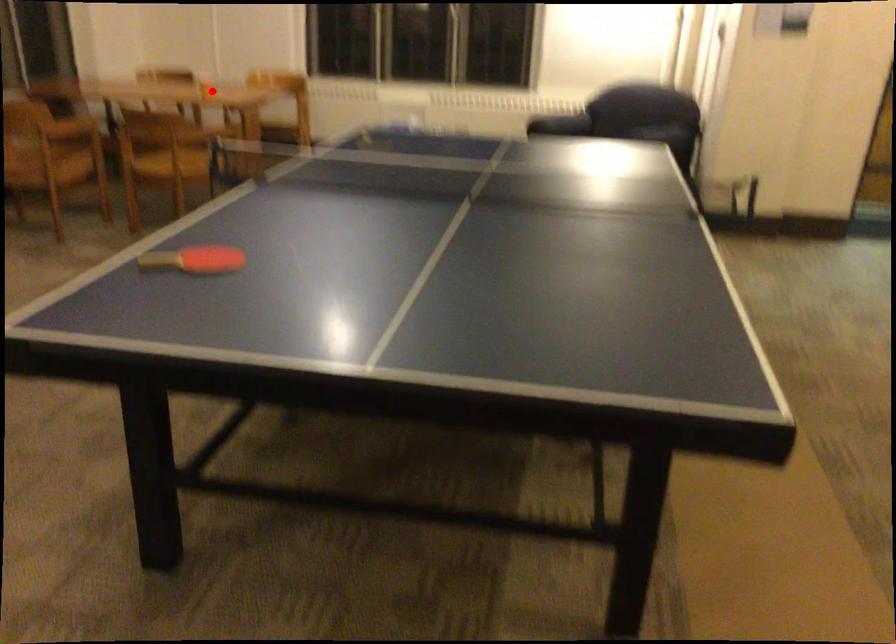
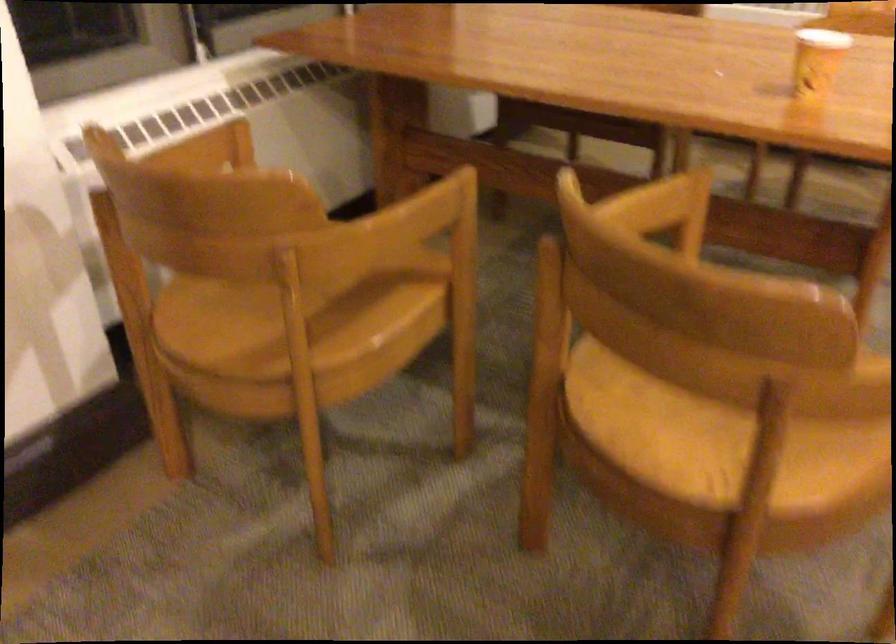
In the second image, find the point that corresponds to the highlighted location in the first image.

(816, 61)